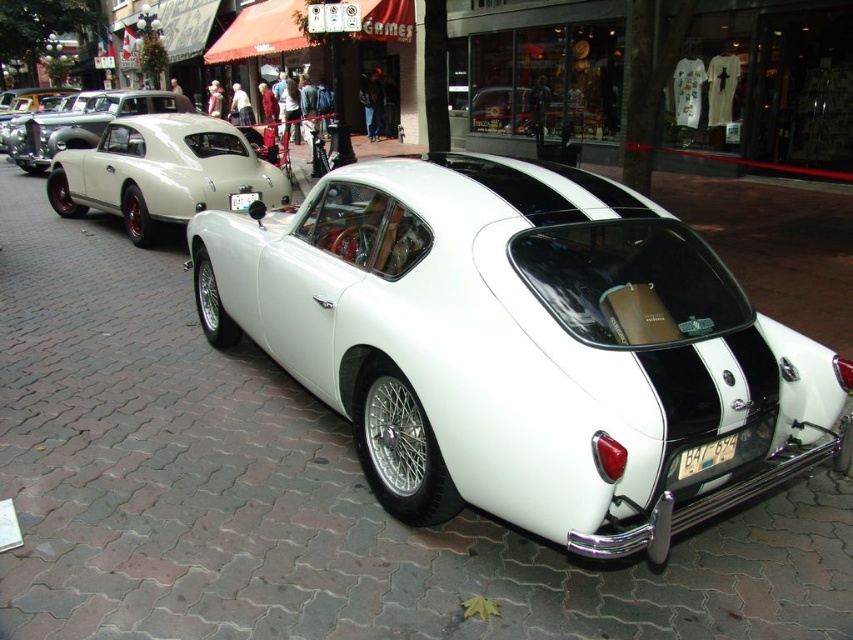
Question: Can you confirm if matte white car at left is bigger than white plastic license plate at center?

Choices:
 (A) no
 (B) yes

Answer: (B)

Question: Is white matte sports car at center bigger than white plastic license plate at center?

Choices:
 (A) yes
 (B) no

Answer: (A)

Question: Is matte white car at left closer to the viewer compared to white glossy car at center?

Choices:
 (A) yes
 (B) no

Answer: (A)

Question: Which object is the farthest from the white plastic license plate at lower right?

Choices:
 (A) white glossy car at center
 (B) matte white car at left
 (C) white matte sports car at center
 (D) white plastic license plate at center

Answer: (A)

Question: Based on their relative distances, which object is nearer to the white plastic license plate at center?

Choices:
 (A) white glossy car at center
 (B) matte white car at left

Answer: (B)

Question: Which object is positioned farthest from the white glossy car at center?

Choices:
 (A) matte white car at left
 (B) white plastic license plate at lower right
 (C) white plastic license plate at center
 (D) white matte sports car at center

Answer: (B)